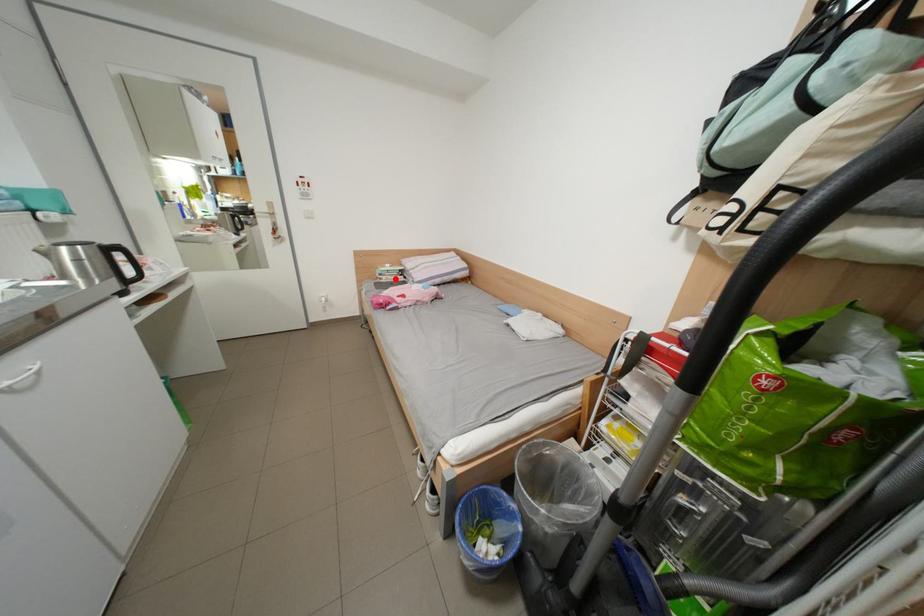
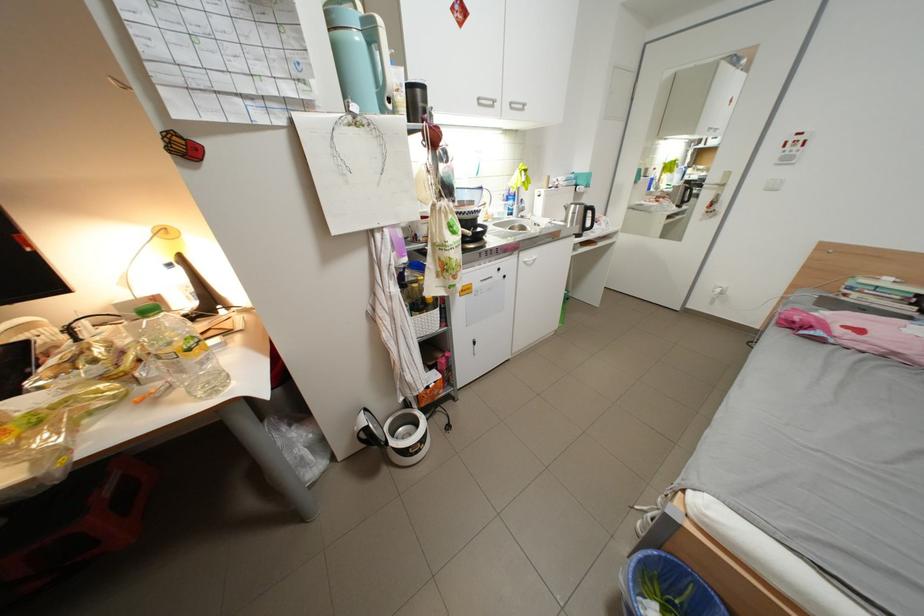
Question: I am providing you with two images of the same scene from different viewpoints. In image1, a red point is highlighted. Considering the same 3D point in image2, which of the following is correct?

Choices:
 (A) It is closer
 (B) It is farther

Answer: (B)